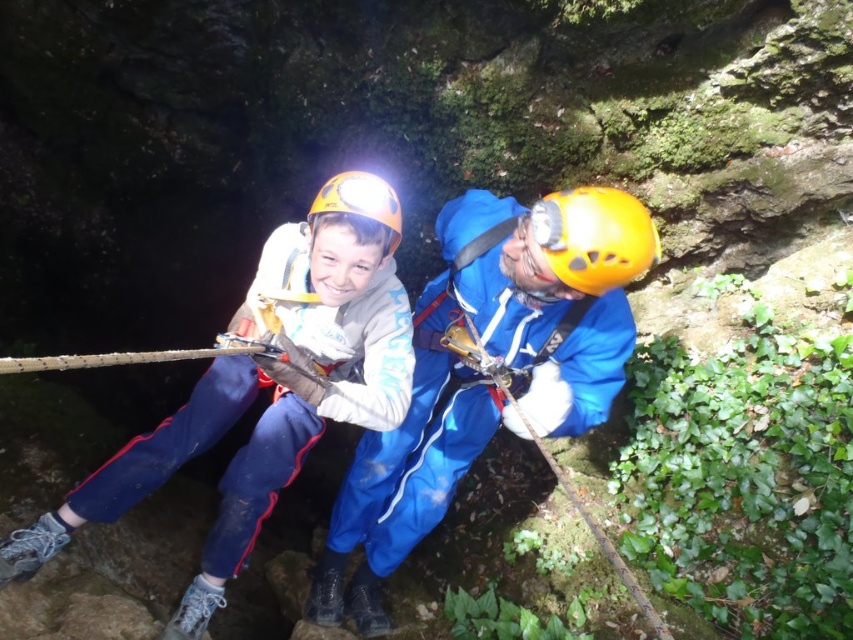
Who is taller, matte blue jumpsuit at center or matte yellow helmet at center?

With more height is matte blue jumpsuit at center.

Between matte blue jumpsuit at center and matte yellow helmet at center, which one appears on the left side from the viewer's perspective?

matte blue jumpsuit at center is more to the left.

Image resolution: width=853 pixels, height=640 pixels. Identify the location of matte blue jumpsuit at center. (254, 397).

Identify the location of matte blue jumpsuit at center. (254, 397).

Does yellow matte helmet at center come behind matte yellow helmet at center?

No, yellow matte helmet at center is in front of matte yellow helmet at center.

Who is positioned more to the left, yellow matte helmet at center or matte yellow helmet at center?

Positioned to the left is matte yellow helmet at center.

Does point (592, 262) come in front of point (390, 214)?

Yes, it is in front of point (390, 214).

The height and width of the screenshot is (640, 853). Find the location of `yellow matte helmet at center`. yellow matte helmet at center is located at coordinates (595, 237).

Which is behind, point (524, 342) or point (374, 220)?

Point (524, 342)

Is blue fabric helmet at center thinner than matte yellow helmet at center?

No, blue fabric helmet at center is not thinner than matte yellow helmet at center.

Which is in front, point (373, 625) or point (350, 182)?

Positioned in front is point (350, 182).

This screenshot has height=640, width=853. I want to click on blue fabric helmet at center, so click(x=492, y=368).